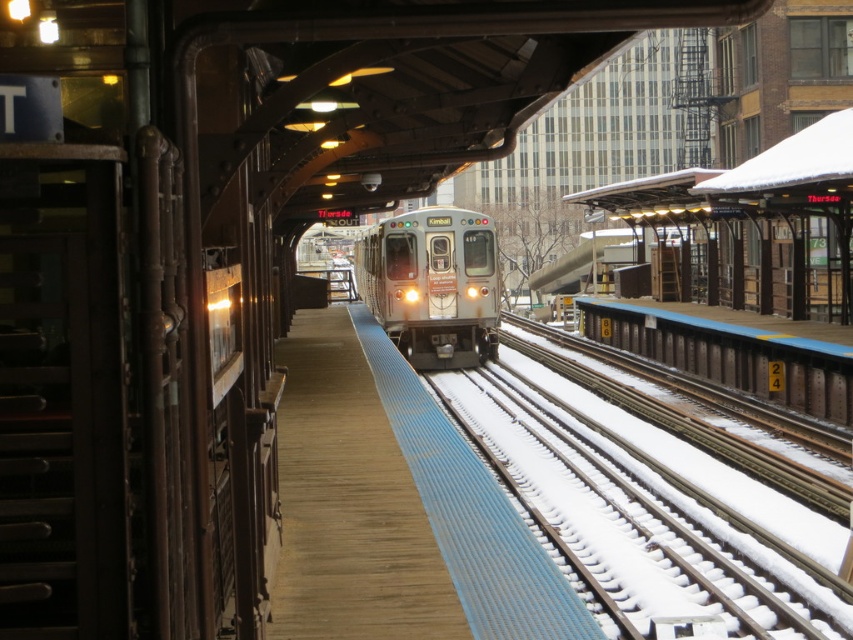
You are standing at the train station platform and want to know which of the two points, point (x=308, y=563) or point (x=486, y=328), is closer to you. Based on the image, which one is nearer?

Point (x=308, y=563) is closer to the viewer than point (x=486, y=328).

You are standing at the train station and want to board the Kimball train. Where should you stand to be closest to the wooden platform at center?

The wooden platform at center is located at point [349,502], so you should stand near that coordinate to be closest to it.

You are a passenger waiting on the wooden platform at center. You see the silver metallic train at center approaching. Can you see the train through the platform?

The wooden platform at center is in front of the silver metallic train at center, so the train is behind the platform and not visible through it.